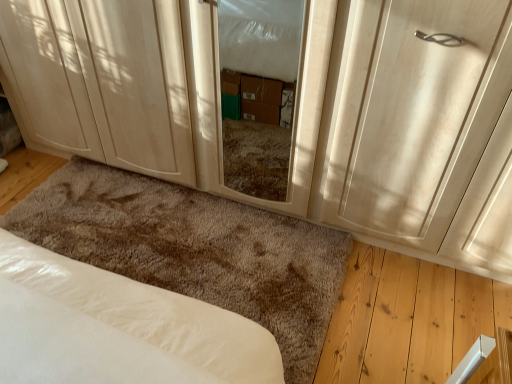
The height and width of the screenshot is (384, 512). I want to click on vacant area that lies between matte wood door at center and white soft bed at lower left, so click(387, 307).